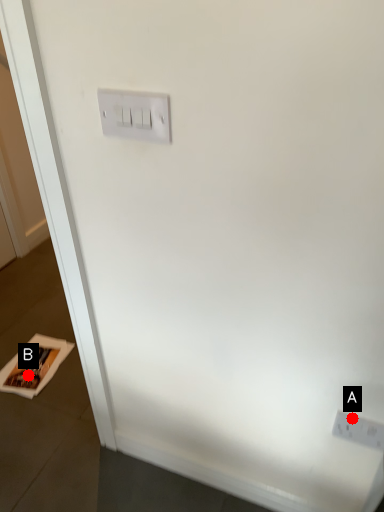
Question: Two points are circled on the image, labeled by A and B beside each circle. Among these points, which one is nearest to the camera?

Choices:
 (A) A is closer
 (B) B is closer

Answer: (A)